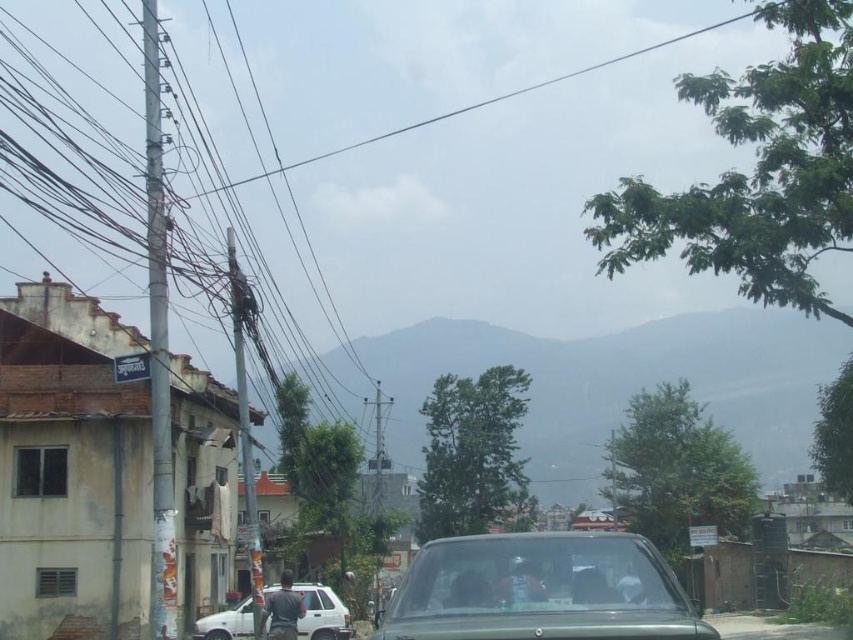
At what (x,y) coordinates should I click in order to perform the action: click on green matte car at center. Please return your answer as a coordinate pair (x, y). The image size is (853, 640). Looking at the image, I should click on (540, 589).

Is point (654, 564) farther from camera compared to point (231, 630)?

No, it is in front of (231, 630).

Does point (506, 572) come farther from viewer compared to point (245, 627)?

No, (506, 572) is in front of (245, 627).

This screenshot has height=640, width=853. What are the coordinates of `green matte car at center` in the screenshot? It's located at (540, 589).